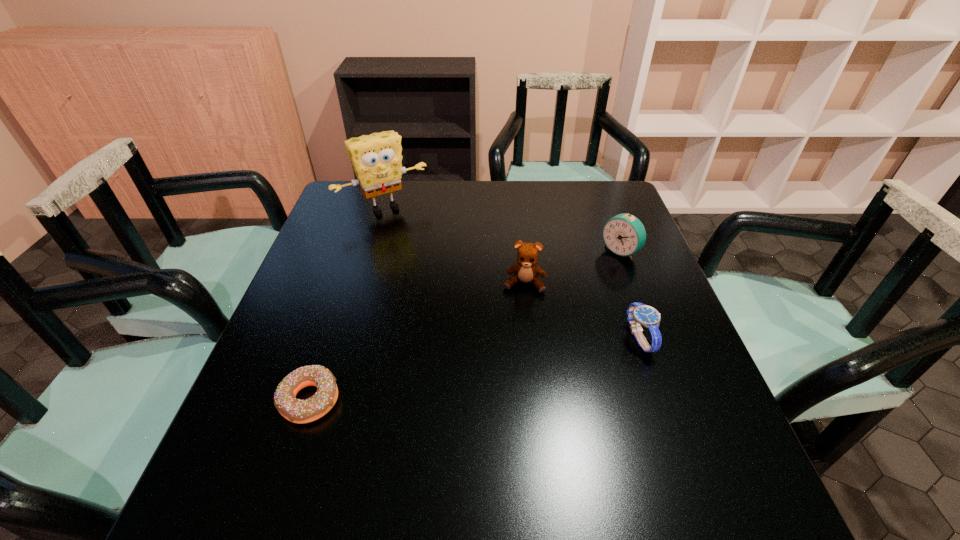
At what (x,y) coordinates should I click in order to perform the action: click on doughnut. Please return your answer as a coordinate pair (x, y). Looking at the image, I should click on (295, 410).

This screenshot has width=960, height=540. What are the coordinates of `the shortest object` in the screenshot? It's located at (295, 410).

Locate an element on the screen. The width and height of the screenshot is (960, 540). watch is located at coordinates (638, 313).

Locate an element on the screen. the fourth farthest object is located at coordinates (638, 313).

You are a GUI agent. You are given a task and a screenshot of the screen. Output one action in this format:
    pyautogui.click(x=<x>, y=<y>)
    Task: Click on the third nearest object
    The height and width of the screenshot is (540, 960).
    Given the screenshot: What is the action you would take?
    pyautogui.click(x=526, y=269)

This screenshot has width=960, height=540. Identify the location of teddy bear. (526, 269).

The height and width of the screenshot is (540, 960). I want to click on the second farthest object, so (x=624, y=234).

Image resolution: width=960 pixels, height=540 pixels. I want to click on the farthest object, so point(376,158).

This screenshot has height=540, width=960. Identify the location of the tallest object. 376,158.

Locate an element on the screen. free space located on the back of the shortest object is located at coordinates (353, 268).